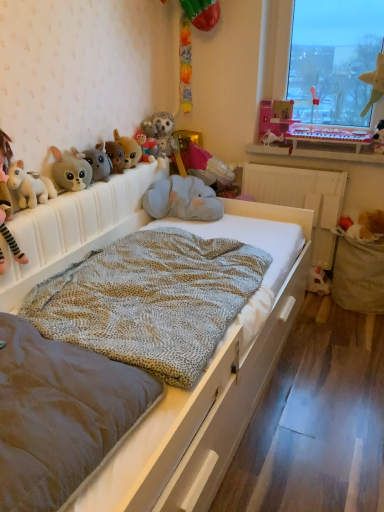
At what (x,y) coordinates should I click in order to perform the action: click on vacant point above white plastic keyboard at upper right (from a real-world perspective). Please return your answer as a coordinate pair (x, y). Looking at the image, I should click on (315, 147).